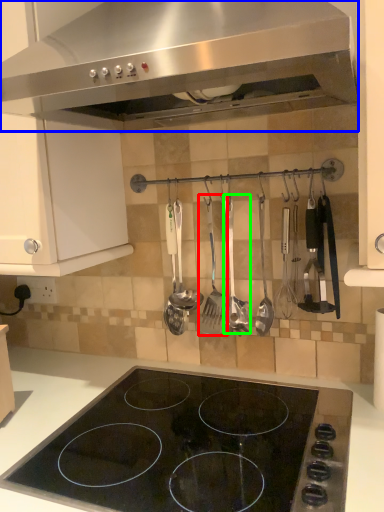
Question: Estimate the real-world distances between objects in this image. Which object is closer to silverware (highlighted by a red box), kitchen appliance (highlighted by a blue box) or silverware (highlighted by a green box)?

Choices:
 (A) kitchen appliance
 (B) silverware

Answer: (B)